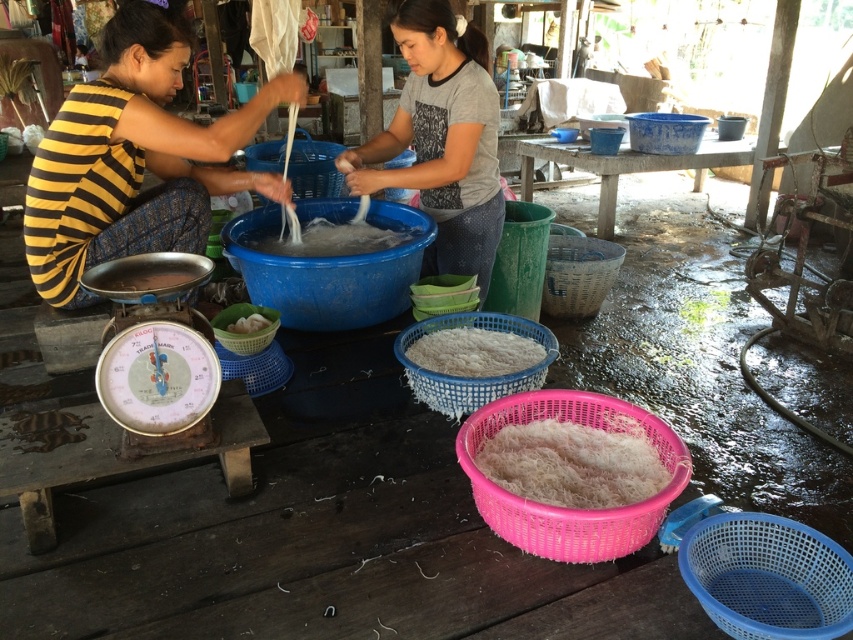
Question: Which of the following is the farthest from the observer?

Choices:
 (A) white fluffy rice at center
 (B) pink woven basket at lower center

Answer: (A)

Question: Is yellow striped fabric at left positioned before white stringy noodles at center?

Choices:
 (A) yes
 (B) no

Answer: (A)

Question: Which of the following is the farthest from the observer?

Choices:
 (A) gray matte shirt at center
 (B) metallic scale at lower left
 (C) white fluffy noodles at center
 (D) white stringy noodles at center

Answer: (D)

Question: Does white fluffy rice at center have a smaller size compared to metallic scale at lower left?

Choices:
 (A) yes
 (B) no

Answer: (B)

Question: Can you confirm if gray matte shirt at center is positioned to the right of white fluffy noodles at center?

Choices:
 (A) no
 (B) yes

Answer: (B)

Question: Which object is the farthest from the white fluffy noodles at center?

Choices:
 (A) gold metallic scale at left
 (B) yellow striped fabric at left
 (C) pink woven basket at lower center
 (D) gray matte shirt at center

Answer: (C)